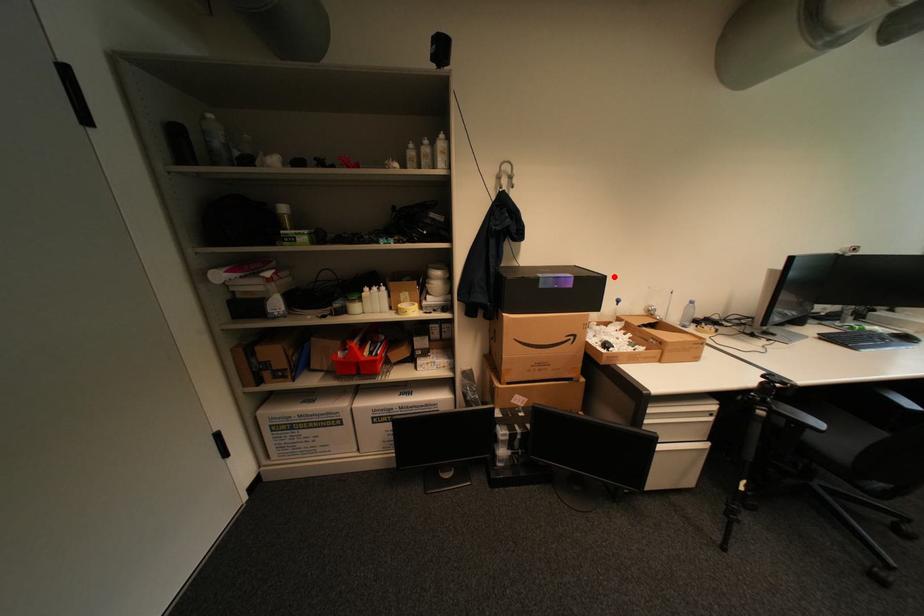
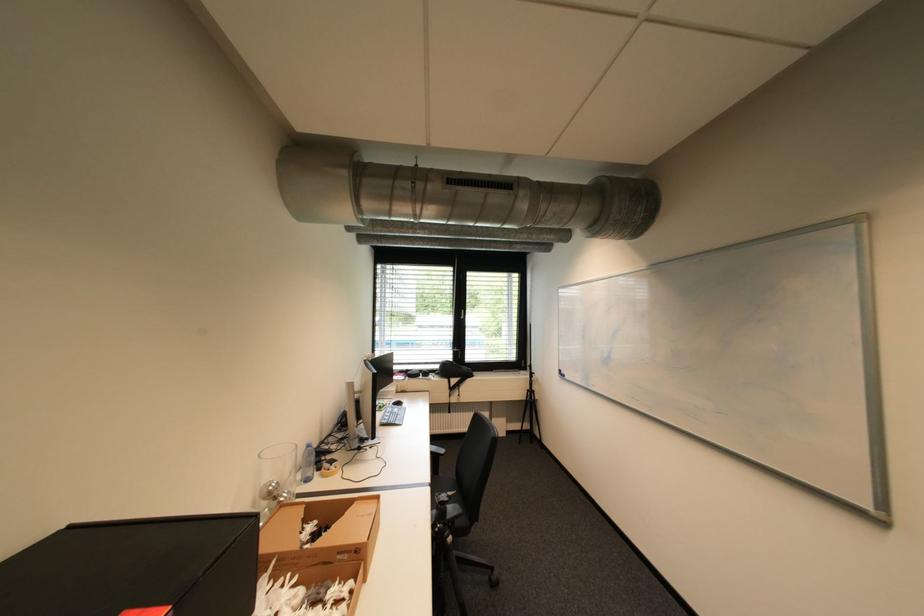
Locate, in the second image, the point that corresponds to the highlighted location in the first image.

(265, 516)